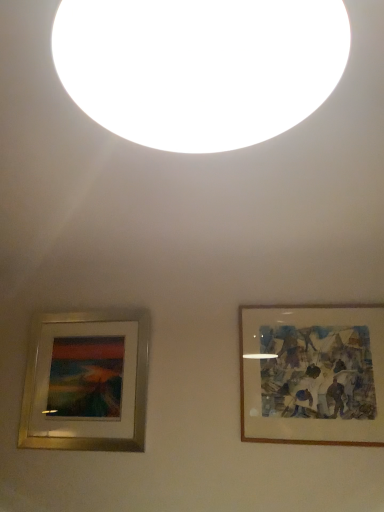
Question: Does wooden frame at right, which appears as the 2th picture frame when viewed from the left, have a greater width compared to white matte light at upper center?

Choices:
 (A) no
 (B) yes

Answer: (A)

Question: Is wooden frame at right, which appears as the 2th picture frame when viewed from the left, to the right of white matte light at upper center from the viewer's perspective?

Choices:
 (A) no
 (B) yes

Answer: (B)

Question: Would you say wooden frame at right, which appears as the 2th picture frame when viewed from the left, is outside white matte light at upper center?

Choices:
 (A) no
 (B) yes

Answer: (B)

Question: Is wooden frame at right, which appears as the 2th picture frame when viewed from the left, positioned before white matte light at upper center?

Choices:
 (A) no
 (B) yes

Answer: (A)

Question: Is wooden frame at right, the first picture frame in the right-to-left sequence, to the left of white matte light at upper center from the viewer's perspective?

Choices:
 (A) no
 (B) yes

Answer: (A)

Question: Considering the relative sizes of wooden frame at right, which appears as the 2th picture frame when viewed from the left, and white matte light at upper center in the image provided, is wooden frame at right, which appears as the 2th picture frame when viewed from the left, smaller than white matte light at upper center?

Choices:
 (A) yes
 (B) no

Answer: (A)

Question: Is gold metallic picture frame at lower left, the second picture frame positioned from the right, placed right next to wooden frame at right, the first picture frame in the right-to-left sequence?

Choices:
 (A) yes
 (B) no

Answer: (B)

Question: Is gold metallic picture frame at lower left, the second picture frame positioned from the right, smaller than wooden frame at right, which appears as the 2th picture frame when viewed from the left?

Choices:
 (A) no
 (B) yes

Answer: (A)

Question: From a real-world perspective, is gold metallic picture frame at lower left, which appears as the 1th picture frame when viewed from the left, on top of wooden frame at right, the first picture frame in the right-to-left sequence?

Choices:
 (A) yes
 (B) no

Answer: (B)

Question: Is gold metallic picture frame at lower left, the second picture frame positioned from the right, at the right side of wooden frame at right, the first picture frame in the right-to-left sequence?

Choices:
 (A) no
 (B) yes

Answer: (A)

Question: Can you confirm if gold metallic picture frame at lower left, which appears as the 1th picture frame when viewed from the left, is bigger than wooden frame at right, which appears as the 2th picture frame when viewed from the left?

Choices:
 (A) yes
 (B) no

Answer: (A)

Question: Can you confirm if gold metallic picture frame at lower left, which appears as the 1th picture frame when viewed from the left, is positioned to the left of wooden frame at right, the first picture frame in the right-to-left sequence?

Choices:
 (A) yes
 (B) no

Answer: (A)

Question: Is gold metallic picture frame at lower left, the second picture frame positioned from the right, positioned in front of white matte light at upper center?

Choices:
 (A) yes
 (B) no

Answer: (B)